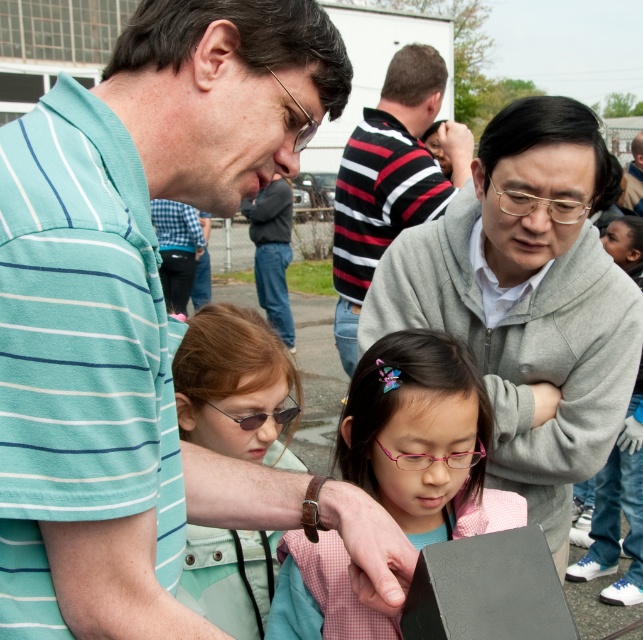
You are standing in the crowd observing the group. Which object is closer to you, the gray matte sweater at upper right or the metallic wireframe glasses at center?

The gray matte sweater at upper right is closer to you because it is further to the viewer than the metallic wireframe glasses at center.

You are a photographer standing at the center of the scene. You need to capture a photo that includes both the teal striped shirt at upper left and the matte gray sweater at upper right. Given that your camera has a maximum horizontal field of view of 15 feet, will you be able to fit both subjects into the frame?

The distance between the teal striped shirt at upper left and the matte gray sweater at upper right is 15.98 feet. Since the camera can only capture up to 15 feet horizontally, the subjects are slightly out of the camera field of view. You won